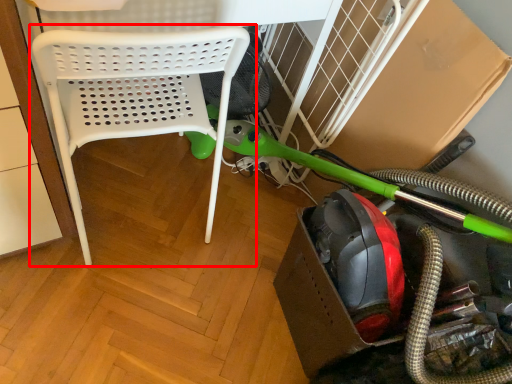
Question: From the image's perspective, what is the correct spatial relationship of chair (annotated by the red box) in relation to garden hose?

Choices:
 (A) below
 (B) above

Answer: (B)